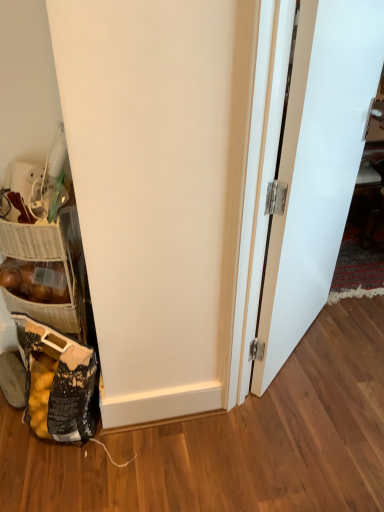
I want to click on vacant space in front of white matte door at right, so click(326, 396).